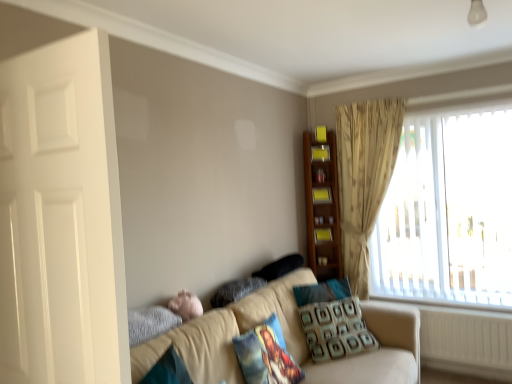
Question: Is there a large distance between beige fabric couch at lower center and pink plush at lower left?

Choices:
 (A) yes
 (B) no

Answer: (B)

Question: Can you confirm if beige fabric couch at lower center is wider than pink plush at lower left?

Choices:
 (A) no
 (B) yes

Answer: (B)

Question: Is beige fabric couch at lower center behind pink plush at lower left?

Choices:
 (A) yes
 (B) no

Answer: (B)

Question: Is beige fabric couch at lower center taller than pink plush at lower left?

Choices:
 (A) yes
 (B) no

Answer: (A)

Question: Does beige fabric couch at lower center appear on the left side of pink plush at lower left?

Choices:
 (A) yes
 (B) no

Answer: (B)

Question: Considering the relative positions of wooden shelf at upper right, which is the first shelf in top-to-bottom order, and beige fabric couch at lower center in the image provided, is wooden shelf at upper right, which is the first shelf in top-to-bottom order, to the left or to the right of beige fabric couch at lower center?

Choices:
 (A) right
 (B) left

Answer: (A)

Question: In terms of height, does wooden shelf at upper right, the 3th shelf in the bottom-to-top sequence, look taller or shorter compared to beige fabric couch at lower center?

Choices:
 (A) tall
 (B) short

Answer: (B)

Question: Choose the correct answer: Is wooden shelf at upper right, the 3th shelf in the bottom-to-top sequence, inside beige fabric couch at lower center or outside it?

Choices:
 (A) inside
 (B) outside

Answer: (B)

Question: From a real-world perspective, is wooden shelf at upper right, which is the first shelf in top-to-bottom order, positioned above or below beige fabric couch at lower center?

Choices:
 (A) above
 (B) below

Answer: (A)

Question: Considering the positions of printed fabric pillow at center, which is counted as the 4th pillow, starting from the back, and white glossy door at left in the image, is printed fabric pillow at center, which is counted as the 4th pillow, starting from the back, wider or thinner than white glossy door at left?

Choices:
 (A) wide
 (B) thin

Answer: (A)

Question: Relative to white glossy door at left, is printed fabric pillow at center, which is counted as the 4th pillow, starting from the back, in front or behind?

Choices:
 (A) front
 (B) behind

Answer: (B)

Question: From a real-world perspective, is printed fabric pillow at center, the first pillow viewed from the front, positioned above or below white glossy door at left?

Choices:
 (A) above
 (B) below

Answer: (B)

Question: In terms of height, does printed fabric pillow at center, which is counted as the 4th pillow, starting from the back, look taller or shorter compared to white glossy door at left?

Choices:
 (A) short
 (B) tall

Answer: (A)

Question: Looking at their shapes, would you say yellow matte bookshelf at upper right, the 2th shelf viewed from the top, is wider or thinner than white plastic radiator at lower right?

Choices:
 (A) wide
 (B) thin

Answer: (B)

Question: Is yellow matte bookshelf at upper right, which ranks as the 2th shelf in bottom-to-top order, in front of or behind white plastic radiator at lower right in the image?

Choices:
 (A) behind
 (B) front

Answer: (A)